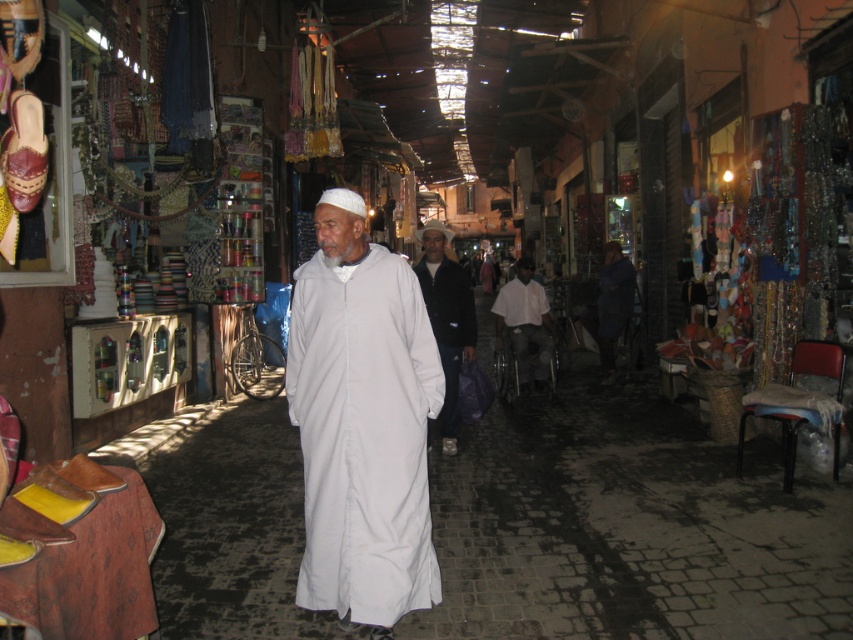
Is white matte clothing at center above white cotton robe at center?

No.

Is white matte clothing at center taller than white cotton robe at center?

Yes.

This screenshot has width=853, height=640. I want to click on white matte clothing at center, so pyautogui.click(x=445, y=320).

Is white cotton shirt at center above white cotton robe at center?

No, white cotton shirt at center is not above white cotton robe at center.

From the picture: Does white cotton shirt at center lie in front of white cotton robe at center?

That is True.

Between point (520, 268) and point (614, 285), which one is positioned behind?

Point (614, 285)

Locate an element on the screen. white cotton shirt at center is located at coordinates (525, 323).

Can you confirm if white matte/soft robe at center is positioned to the left of white cotton shirt at center?

Indeed, white matte/soft robe at center is positioned on the left side of white cotton shirt at center.

Is point (381, 547) positioned before point (535, 320)?

Yes, it is in front of point (535, 320).

Identify the location of white matte/soft robe at center. Image resolution: width=853 pixels, height=640 pixels. (363, 422).